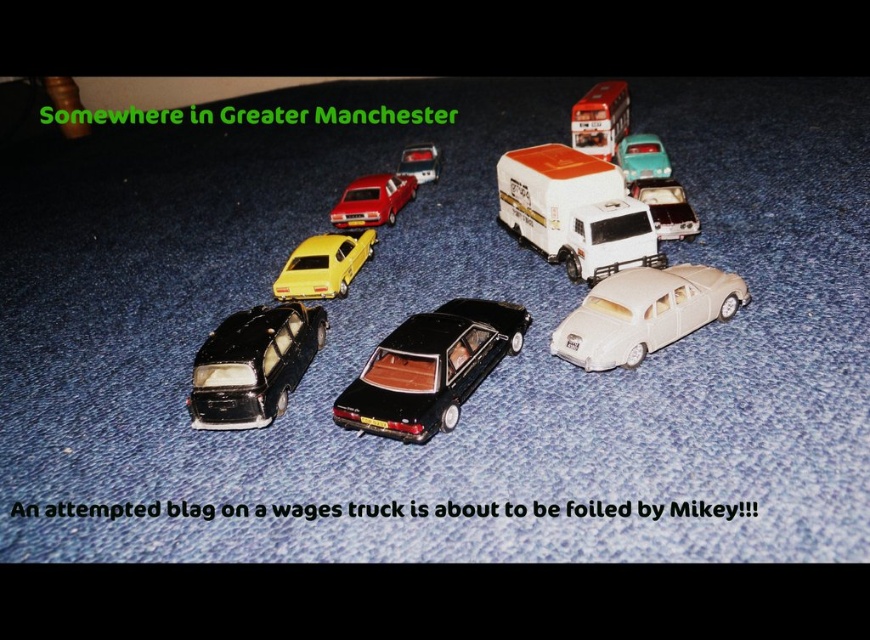
Where is `glossy black sedan at center`? This screenshot has height=640, width=870. glossy black sedan at center is located at coordinates (430, 369).

Does glossy black sedan at center have a greater width compared to glossy black car at center-left?

Yes.

Locate an element on the screen. This screenshot has width=870, height=640. glossy black sedan at center is located at coordinates tap(430, 369).

What do you see at coordinates (573, 212) in the screenshot? The height and width of the screenshot is (640, 870). I see `glossy black car at center` at bounding box center [573, 212].

Is glossy black car at center to the left of white glossy truck at center from the viewer's perspective?

Yes, glossy black car at center is to the left of white glossy truck at center.

Is point (422, 426) closer to camera compared to point (589, 163)?

Yes, point (422, 426) is closer to viewer.

In order to click on glossy black car at center in this screenshot , I will do `click(573, 212)`.

Consider the image. Can you confirm if glossy black car at center is bigger than metallic silver truck at center-right?

Indeed, glossy black car at center has a larger size compared to metallic silver truck at center-right.

In the scene shown: Who is positioned more to the left, glossy black car at center or metallic silver truck at center-right?

Positioned to the left is glossy black car at center.

Which is in front, point (396, 417) or point (647, 188)?

Point (396, 417)

This screenshot has width=870, height=640. I want to click on glossy black car at center, so click(x=573, y=212).